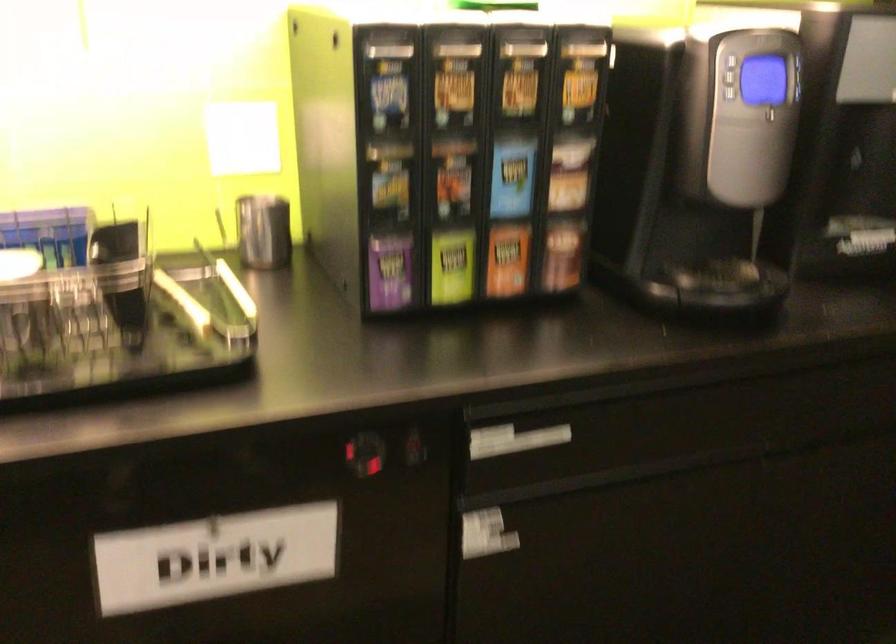
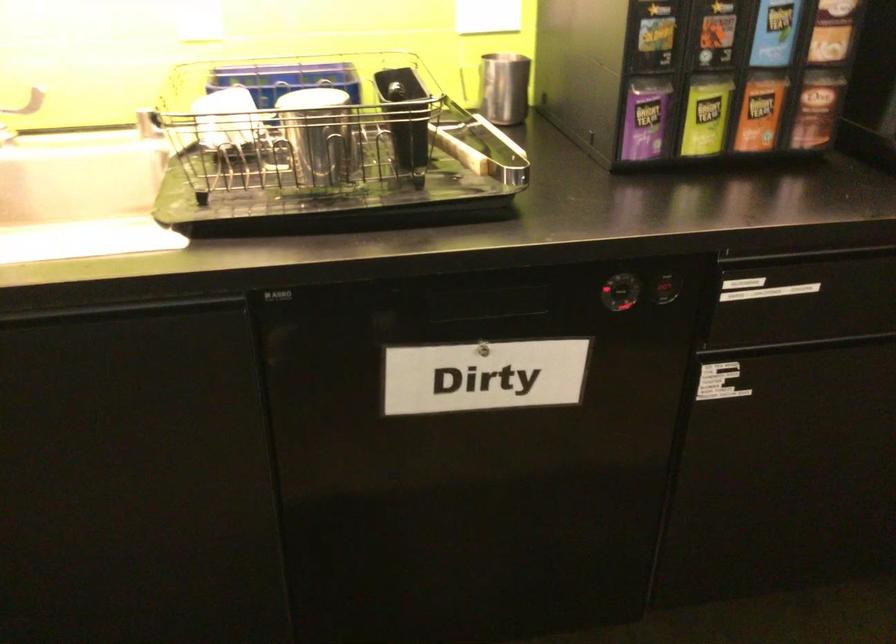
In the second image, find the point that corresponds to point (554, 406) in the first image.

(807, 254)